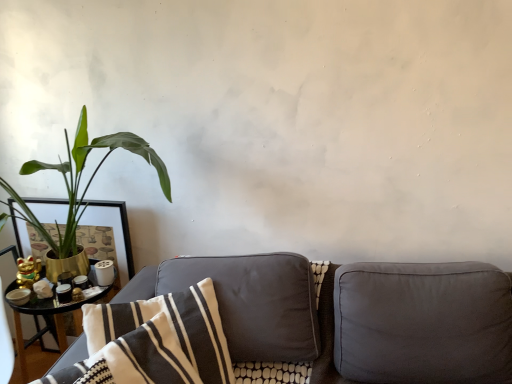
Describe the element at coordinates (423, 323) in the screenshot. Image resolution: width=512 pixels, height=384 pixels. I see `suede-like gray pillow at right, which ranks as the 2th pillow in left-to-right order` at that location.

The height and width of the screenshot is (384, 512). What are the coordinates of `suede gray couch at lower center` in the screenshot? It's located at (378, 320).

Describe the element at coordinates (79, 181) in the screenshot. I see `gold metallic pot at left` at that location.

I want to click on matte black picture frame at left, so click(113, 232).

The width and height of the screenshot is (512, 384). Describe the element at coordinates (164, 338) in the screenshot. I see `white striped fabric pillow at center, positioned as the second pillow in right-to-left order` at that location.

Measure the distance between point [221,366] and camera.

Point [221,366] and camera are 4.92 feet apart.

Locate an element on the screen. The width and height of the screenshot is (512, 384). suede-like gray pillow at right, acting as the first pillow starting from the right is located at coordinates (423, 323).

Looking at this image, which object is further away from the camera, matte black picture frame at left or suede-like gray pillow at right, which ranks as the 2th pillow in left-to-right order?

matte black picture frame at left is further away from the camera.

Is matte black picture frame at left turned away from suede-like gray pillow at right, acting as the first pillow starting from the right?

That's not correct — matte black picture frame at left is not looking away from suede-like gray pillow at right, acting as the first pillow starting from the right.

Is matte black picture frame at left not within suede-like gray pillow at right, which ranks as the 2th pillow in left-to-right order?

Yes, matte black picture frame at left is not within suede-like gray pillow at right, which ranks as the 2th pillow in left-to-right order.

Are white striped fabric pillow at center, acting as the first pillow starting from the left, and suede-like gray pillow at right, acting as the first pillow starting from the right, far apart?

That's not correct — white striped fabric pillow at center, acting as the first pillow starting from the left, is a little close to suede-like gray pillow at right, acting as the first pillow starting from the right.

Which object is wider, white striped fabric pillow at center, acting as the first pillow starting from the left, or suede-like gray pillow at right, which ranks as the 2th pillow in left-to-right order?

suede-like gray pillow at right, which ranks as the 2th pillow in left-to-right order.

Based on their sizes in the image, would you say white striped fabric pillow at center, acting as the first pillow starting from the left, is bigger or smaller than suede-like gray pillow at right, which ranks as the 2th pillow in left-to-right order?

In the image, white striped fabric pillow at center, acting as the first pillow starting from the left, appears to be smaller than suede-like gray pillow at right, which ranks as the 2th pillow in left-to-right order.

From a real-world perspective, which object stands above the other?

white striped fabric pillow at center, acting as the first pillow starting from the left.

From a real-world perspective, is matte black picture frame at left located beneath suede gray couch at lower center?

No.

Is matte black picture frame at left wider than suede gray couch at lower center?

No.

How distant is matte black picture frame at left from suede gray couch at lower center?

They are 36.81 inches apart.

What's the angular difference between matte black picture frame at left and suede gray couch at lower center's facing directions?

The facing directions of matte black picture frame at left and suede gray couch at lower center are 1.42 degrees apart.

Is white striped fabric pillow at center, acting as the first pillow starting from the left, not close to gold metallic pot at left?

white striped fabric pillow at center, acting as the first pillow starting from the left, is near gold metallic pot at left, not far away.

From a real-world perspective, which object stands above the other?

In real-world perspective, gold metallic pot at left is above.

From the image's perspective, between white striped fabric pillow at center, acting as the first pillow starting from the left, and gold metallic pot at left, which one is located above?

gold metallic pot at left appears higher in the image.

Which is more to the right, white striped fabric pillow at center, positioned as the second pillow in right-to-left order, or gold metallic pot at left?

Positioned to the right is white striped fabric pillow at center, positioned as the second pillow in right-to-left order.

Between point (102, 211) and point (135, 151), which one is positioned in front?

Point (135, 151)

Considering the relative sizes of matte black picture frame at left and gold metallic pot at left in the image provided, is matte black picture frame at left thinner than gold metallic pot at left?

Yes.

How different are the orientations of matte black picture frame at left and gold metallic pot at left in degrees?

2.16 degrees.

Looking at this image, from a real-world perspective, is matte black picture frame at left positioned over gold metallic pot at left based on gravity?

No, from a real-world perspective, matte black picture frame at left is not above gold metallic pot at left.

You are a GUI agent. You are given a task and a screenshot of the screen. Output one action in this format:
    pyautogui.click(x=<x>, y=<y>)
    Task: Click on the 2nd pillow in front of the matte black picture frame at left, starting your count from the anchor
    This screenshot has width=512, height=384.
    Given the screenshot: What is the action you would take?
    pyautogui.click(x=164, y=338)

In the image, is white striped fabric pillow at center, positioned as the second pillow in right-to-left order, on the left side or the right side of matte black picture frame at left?

In the image, white striped fabric pillow at center, positioned as the second pillow in right-to-left order, appears on the right side of matte black picture frame at left.

Considering the sizes of objects white striped fabric pillow at center, positioned as the second pillow in right-to-left order, and matte black picture frame at left in the image provided, who is smaller, white striped fabric pillow at center, positioned as the second pillow in right-to-left order, or matte black picture frame at left?

matte black picture frame at left.

Does white striped fabric pillow at center, acting as the first pillow starting from the left, come in front of matte black picture frame at left?

Yes, the depth of white striped fabric pillow at center, acting as the first pillow starting from the left, is less than that of matte black picture frame at left.

Is there a large distance between gold metallic pot at left and suede-like gray pillow at right, acting as the first pillow starting from the right?

Indeed, gold metallic pot at left is not near suede-like gray pillow at right, acting as the first pillow starting from the right.

From the image's perspective, who appears lower, gold metallic pot at left or suede-like gray pillow at right, acting as the first pillow starting from the right?

suede-like gray pillow at right, acting as the first pillow starting from the right.

Which object is thinner, gold metallic pot at left or suede-like gray pillow at right, acting as the first pillow starting from the right?

gold metallic pot at left is thinner.

Where is `the 2nd pillow below the gold metallic pot at left (from a real-world perspective)`? The width and height of the screenshot is (512, 384). the 2nd pillow below the gold metallic pot at left (from a real-world perspective) is located at coordinates (423, 323).

Find the location of `picture frame above the suede-like gray pillow at right, acting as the first pillow starting from the right (from a real-world perspective)`. picture frame above the suede-like gray pillow at right, acting as the first pillow starting from the right (from a real-world perspective) is located at coordinates (113, 232).

At what (x,y) coordinates should I click in order to perform the action: click on pillow in front of the suede-like gray pillow at right, which ranks as the 2th pillow in left-to-right order. Please return your answer as a coordinate pair (x, y). The image size is (512, 384). Looking at the image, I should click on (164, 338).

Considering their positions, is white striped fabric pillow at center, positioned as the second pillow in right-to-left order, positioned further to suede gray couch at lower center than matte black picture frame at left?

matte black picture frame at left.

When comparing their distances from matte black picture frame at left, does suede-like gray pillow at right, acting as the first pillow starting from the right, or gold metallic pot at left seem further?

suede-like gray pillow at right, acting as the first pillow starting from the right.

Estimate the real-world distances between objects in this image. Which object is closer to suede gray couch at lower center, suede-like gray pillow at right, which ranks as the 2th pillow in left-to-right order, or gold metallic pot at left?

The object closer to suede gray couch at lower center is suede-like gray pillow at right, which ranks as the 2th pillow in left-to-right order.

From the image, which object appears to be nearer to gold metallic pot at left, white striped fabric pillow at center, acting as the first pillow starting from the left, or suede-like gray pillow at right, acting as the first pillow starting from the right?

white striped fabric pillow at center, acting as the first pillow starting from the left.

Considering their positions, is gold metallic pot at left positioned closer to suede-like gray pillow at right, acting as the first pillow starting from the right, than suede gray couch at lower center?

suede gray couch at lower center is positioned closer to the anchor suede-like gray pillow at right, acting as the first pillow starting from the right.

Based on their spatial positions, is suede-like gray pillow at right, which ranks as the 2th pillow in left-to-right order, or suede gray couch at lower center further from white striped fabric pillow at center, acting as the first pillow starting from the left?

suede-like gray pillow at right, which ranks as the 2th pillow in left-to-right order, is positioned further to the anchor white striped fabric pillow at center, acting as the first pillow starting from the left.

From the picture: Considering their positions, is gold metallic pot at left positioned further to matte black picture frame at left than white striped fabric pillow at center, positioned as the second pillow in right-to-left order?

white striped fabric pillow at center, positioned as the second pillow in right-to-left order, lies further to matte black picture frame at left than the other object.

Estimate the real-world distances between objects in this image. Which object is closer to gold metallic pot at left, suede gray couch at lower center or matte black picture frame at left?

The object closer to gold metallic pot at left is matte black picture frame at left.

Locate an element on the screen. The height and width of the screenshot is (384, 512). studio couch between matte black picture frame at left and suede-like gray pillow at right, acting as the first pillow starting from the right is located at coordinates (378, 320).

This screenshot has width=512, height=384. Identify the location of pillow situated between matte black picture frame at left and suede-like gray pillow at right, acting as the first pillow starting from the right, from left to right. (164, 338).

This screenshot has width=512, height=384. What are the coordinates of `pillow between gold metallic pot at left and suede-like gray pillow at right, which ranks as the 2th pillow in left-to-right order, in the horizontal direction` in the screenshot? It's located at (164, 338).

The image size is (512, 384). What are the coordinates of `houseplant positioned between white striped fabric pillow at center, positioned as the second pillow in right-to-left order, and matte black picture frame at left from near to far` in the screenshot? It's located at (79, 181).